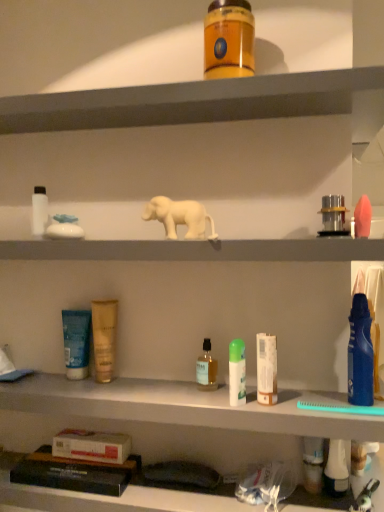
Locate an element on the screen. The height and width of the screenshot is (512, 384). white matte bottle at left, the first toiletry viewed from the left is located at coordinates (39, 211).

The height and width of the screenshot is (512, 384). What do you see at coordinates (313, 464) in the screenshot? I see `translucent plastic cup at lower right, arranged as the fifth toiletry when viewed from the right` at bounding box center [313, 464].

Locate an element on the screen. Image resolution: width=384 pixels, height=512 pixels. translucent plastic cup at lower right, arranged as the fifth toiletry when viewed from the right is located at coordinates (313, 464).

The height and width of the screenshot is (512, 384). What are the coordinates of `metallic silver canister at upper right, the 9th toiletry when ordered from left to right` in the screenshot? It's located at (333, 215).

Measure the distance between point (206, 343) and camera.

A distance of 35.16 inches exists between point (206, 343) and camera.

The width and height of the screenshot is (384, 512). What do you see at coordinates (180, 217) in the screenshot?
I see `white matte elephant at center` at bounding box center [180, 217].

The width and height of the screenshot is (384, 512). What are the coordinates of `matte orange jar at upper center, marked as the fifth toiletry in a left-to-right arrangement` in the screenshot? It's located at (229, 40).

Find the location of `white matte bottle at left, marked as the 12th toiletry in a right-to-left arrangement`. white matte bottle at left, marked as the 12th toiletry in a right-to-left arrangement is located at coordinates (39, 211).

Considering the positions of objects blue matte tube at middle left, which is counted as the eleventh toiletry, starting from the right, and matte gold tube at center, the 10th toiletry from the right, in the image provided, who is in front, blue matte tube at middle left, which is counted as the eleventh toiletry, starting from the right, or matte gold tube at center, the 10th toiletry from the right,?

matte gold tube at center, the 10th toiletry from the right.

Considering the relative sizes of blue matte tube at middle left, the second toiletry when ordered from left to right, and matte gold tube at center, placed as the third toiletry when sorted from left to right, in the image provided, is blue matte tube at middle left, the second toiletry when ordered from left to right, wider than matte gold tube at center, placed as the third toiletry when sorted from left to right,?

Correct, the width of blue matte tube at middle left, the second toiletry when ordered from left to right, exceeds that of matte gold tube at center, placed as the third toiletry when sorted from left to right.

The width and height of the screenshot is (384, 512). In order to click on the 1st toiletry above the blue matte tube at middle left, the second toiletry when ordered from left to right (from the image's perspective) in this screenshot , I will do `click(104, 338)`.

Could you tell me if blue matte tube at middle left, the second toiletry when ordered from left to right, is turned towards matte gold tube at center, placed as the third toiletry when sorted from left to right?

No, blue matte tube at middle left, the second toiletry when ordered from left to right, is not oriented towards matte gold tube at center, placed as the third toiletry when sorted from left to right.

Is the position of white matte tube at center, which is counted as the 6th toiletry, starting from the right, more distant than that of translucent plastic cup at lower right, arranged as the fifth toiletry when viewed from the right?

No, it is not.

From a real-world perspective, which object stands above the other?

white matte tube at center, which is counted as the 6th toiletry, starting from the right.

Looking at this image, what's the angular difference between white matte tube at center, marked as the seventh toiletry in a left-to-right arrangement, and translucent plastic cup at lower right, arranged as the fifth toiletry when viewed from the right,'s facing directions?

They differ by 0.00358 degrees in their facing directions.

Is white matte tube at center, which is counted as the 6th toiletry, starting from the right, positioned far away from translucent plastic cup at lower right, positioned as the eighth toiletry in left-to-right order?

No.

Is matte gold tube at center, placed as the third toiletry when sorted from left to right, wider or thinner than metallic silver canister at upper right, positioned as the 4th toiletry in right-to-left order?

In the image, matte gold tube at center, placed as the third toiletry when sorted from left to right, appears to be more narrow than metallic silver canister at upper right, positioned as the 4th toiletry in right-to-left order.

Starting from the matte gold tube at center, the 10th toiletry from the right, which toiletry is the 7th one in front? Please provide its 2D coordinates.

[(333, 215)]

Does matte gold tube at center, the 10th toiletry from the right, have a larger size compared to metallic silver canister at upper right, positioned as the 4th toiletry in right-to-left order?

Yes.

Who is smaller, blue matte tube at middle left, the second toiletry when ordered from left to right, or matte orange jar at upper center, marked as the fifth toiletry in a left-to-right arrangement?

→ blue matte tube at middle left, the second toiletry when ordered from left to right, is smaller.

From the image's perspective, between blue matte tube at middle left, which is counted as the eleventh toiletry, starting from the right, and matte orange jar at upper center, which ranks as the eighth toiletry in right-to-left order, which one is located above?

matte orange jar at upper center, which ranks as the eighth toiletry in right-to-left order, is shown above in the image.

Considering the relative sizes of blue matte tube at middle left, the second toiletry when ordered from left to right, and matte orange jar at upper center, marked as the fifth toiletry in a left-to-right arrangement, in the image provided, is blue matte tube at middle left, the second toiletry when ordered from left to right, shorter than matte orange jar at upper center, marked as the fifth toiletry in a left-to-right arrangement,?

No.

Is blue matte tube at middle left, which is counted as the eleventh toiletry, starting from the right, in contact with matte orange jar at upper center, marked as the fifth toiletry in a left-to-right arrangement?

No.

Is blue glossy hair spray at lower right, the 11th toiletry in the left-to-right sequence, in contact with white matte bottle at left, the first toiletry viewed from the left?

No, blue glossy hair spray at lower right, the 11th toiletry in the left-to-right sequence, is not beside white matte bottle at left, the first toiletry viewed from the left.

Is blue glossy hair spray at lower right, placed as the 2th toiletry when sorted from right to left, positioned with its back to white matte bottle at left, the first toiletry viewed from the left?

No, blue glossy hair spray at lower right, placed as the 2th toiletry when sorted from right to left,'s orientation is not away from white matte bottle at left, the first toiletry viewed from the left.

Does point (365, 362) come behind point (44, 190)?

No, (365, 362) is in front of (44, 190).

From the picture: Would you say blue glossy hair spray at lower right, the 11th toiletry in the left-to-right sequence, is inside or outside white matte bottle at left, marked as the 12th toiletry in a right-to-left arrangement?

The correct answer is: outside.

Which is less distant, (212,65) or (313,457)?

Point (212,65).

Who is taller, matte orange jar at upper center, which ranks as the eighth toiletry in right-to-left order, or translucent plastic cup at lower right, arranged as the fifth toiletry when viewed from the right?

Standing taller between the two is matte orange jar at upper center, which ranks as the eighth toiletry in right-to-left order.

Which of these two, matte orange jar at upper center, marked as the fifth toiletry in a left-to-right arrangement, or translucent plastic cup at lower right, arranged as the fifth toiletry when viewed from the right, is thinner?

translucent plastic cup at lower right, arranged as the fifth toiletry when viewed from the right.

Does matte orange jar at upper center, marked as the fifth toiletry in a left-to-right arrangement, turn towards translucent plastic cup at lower right, positioned as the eighth toiletry in left-to-right order?

No, matte orange jar at upper center, marked as the fifth toiletry in a left-to-right arrangement, is not turned towards translucent plastic cup at lower right, positioned as the eighth toiletry in left-to-right order.

Is white matte tube at center, marked as the seventh toiletry in a left-to-right arrangement, completely or partially outside of blue glossy hair spray at lower right, placed as the 2th toiletry when sorted from right to left?

Yes, white matte tube at center, marked as the seventh toiletry in a left-to-right arrangement, is located beyond the bounds of blue glossy hair spray at lower right, placed as the 2th toiletry when sorted from right to left.

From the image's perspective, would you say white matte tube at center, which is counted as the 6th toiletry, starting from the right, is shown under blue glossy hair spray at lower right, the 11th toiletry in the left-to-right sequence?

Yes.

Considering the positions of objects white matte tube at center, marked as the seventh toiletry in a left-to-right arrangement, and blue glossy hair spray at lower right, the 11th toiletry in the left-to-right sequence, in the image provided, who is more to the left, white matte tube at center, marked as the seventh toiletry in a left-to-right arrangement, or blue glossy hair spray at lower right, the 11th toiletry in the left-to-right sequence,?

white matte tube at center, marked as the seventh toiletry in a left-to-right arrangement.

Image resolution: width=384 pixels, height=512 pixels. I want to click on the 1st toiletry located above the blue matte tube at middle left, which is counted as the eleventh toiletry, starting from the right (from a real-world perspective), so click(104, 338).

From the white matte tube at center, which is counted as the 6th toiletry, starting from the right, count 4th toiletrys backward and point to it. Please provide its 2D coordinates.

[(313, 464)]

Based on their spatial positions, is pink matte sponge at right, the first toiletry in the right-to-left sequence, or translucent glass bottle at center, the 9th toiletry from the right, closer to blue matte tube at middle left, the second toiletry when ordered from left to right?

translucent glass bottle at center, the 9th toiletry from the right, is positioned closer to the anchor blue matte tube at middle left, the second toiletry when ordered from left to right.

When comparing their distances from metallic silver canister at upper right, positioned as the 4th toiletry in right-to-left order, does white matte bottle at left, the first toiletry viewed from the left, or matte orange jar at upper center, which ranks as the eighth toiletry in right-to-left order, seem further?

The object further to metallic silver canister at upper right, positioned as the 4th toiletry in right-to-left order, is white matte bottle at left, the first toiletry viewed from the left.

From the image, which object appears to be farther from white plastic spray bottle at lower right, placed as the 3th toiletry when sorted from right to left, white matte tube at center, marked as the seventh toiletry in a left-to-right arrangement, or blue matte tube at middle left, the second toiletry when ordered from left to right?

The object further to white plastic spray bottle at lower right, placed as the 3th toiletry when sorted from right to left, is blue matte tube at middle left, the second toiletry when ordered from left to right.

In the scene shown: Considering their positions, is translucent plastic cup at lower right, positioned as the eighth toiletry in left-to-right order, positioned further to pink matte sponge at right, the first toiletry in the right-to-left sequence, than metallic silver canister at upper right, positioned as the 4th toiletry in right-to-left order?

translucent plastic cup at lower right, positioned as the eighth toiletry in left-to-right order.

Which object lies nearer to the anchor point matte orange jar at upper center, marked as the fifth toiletry in a left-to-right arrangement, translucent glass bottle at center, placed as the fourth toiletry when sorted from left to right, or pink matte sponge at right, which is the twelfth toiletry in left-to-right order?

pink matte sponge at right, which is the twelfth toiletry in left-to-right order, lies closer to matte orange jar at upper center, marked as the fifth toiletry in a left-to-right arrangement, than the other object.

Estimate the real-world distances between objects in this image. Which object is closer to metallic silver canister at upper right, the 9th toiletry when ordered from left to right, translucent plastic cup at lower right, arranged as the fifth toiletry when viewed from the right, or green matte spray can at center, positioned as the 7th toiletry in right-to-left order?

green matte spray can at center, positioned as the 7th toiletry in right-to-left order, is closer to metallic silver canister at upper right, the 9th toiletry when ordered from left to right.

Which object lies nearer to the anchor point white matte bottle at left, the first toiletry viewed from the left, translucent plastic cup at lower right, arranged as the fifth toiletry when viewed from the right, or matte orange jar at upper center, marked as the fifth toiletry in a left-to-right arrangement?

matte orange jar at upper center, marked as the fifth toiletry in a left-to-right arrangement, is positioned closer to the anchor white matte bottle at left, the first toiletry viewed from the left.

Considering their positions, is white matte tube at center, marked as the seventh toiletry in a left-to-right arrangement, positioned further to translucent plastic cup at lower right, positioned as the eighth toiletry in left-to-right order, than green matte spray can at center, acting as the sixth toiletry starting from the left?

Based on the image, green matte spray can at center, acting as the sixth toiletry starting from the left, appears to be further to translucent plastic cup at lower right, positioned as the eighth toiletry in left-to-right order.

The height and width of the screenshot is (512, 384). I want to click on elephant between matte orange jar at upper center, marked as the fifth toiletry in a left-to-right arrangement, and white plastic spray bottle at lower right, placed as the 3th toiletry when sorted from right to left, in the vertical direction, so click(x=180, y=217).

Where is `elephant between matte gold tube at center, placed as the third toiletry when sorted from left to right, and blue glossy hair spray at lower right, the 11th toiletry in the left-to-right sequence`? elephant between matte gold tube at center, placed as the third toiletry when sorted from left to right, and blue glossy hair spray at lower right, the 11th toiletry in the left-to-right sequence is located at coordinates (180, 217).

Identify the location of elephant located between white matte bottle at left, the first toiletry viewed from the left, and matte orange jar at upper center, marked as the fifth toiletry in a left-to-right arrangement, in the left-right direction. Image resolution: width=384 pixels, height=512 pixels. (180, 217).

The width and height of the screenshot is (384, 512). What are the coordinates of `elephant that lies between matte orange jar at upper center, marked as the fifth toiletry in a left-to-right arrangement, and green matte spray can at center, positioned as the 7th toiletry in right-to-left order, from top to bottom` in the screenshot? It's located at (180, 217).